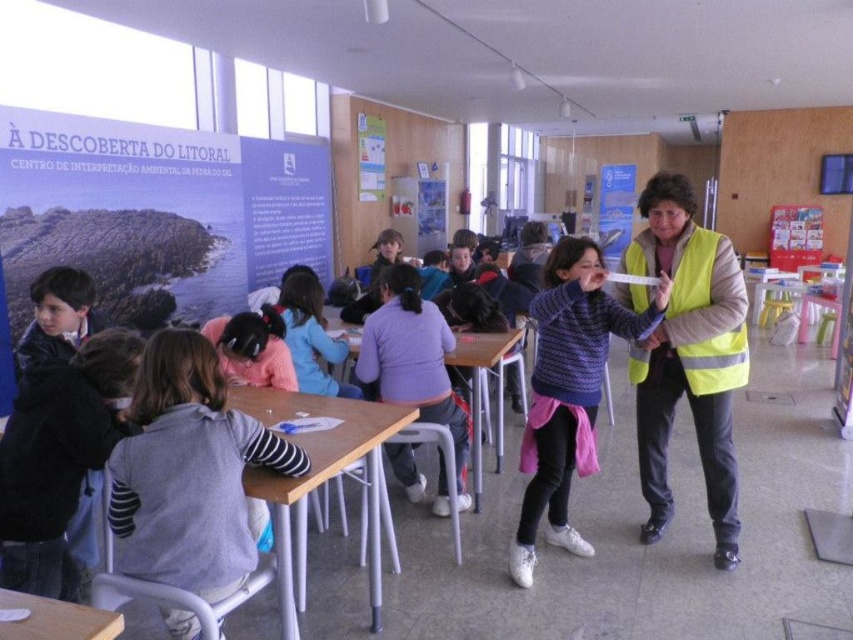
You are a teacher in the classroom and need to pass between the gray sweater at left and the knitted sweater at center to reach the whiteboard. Can you walk through the space between them without bending?

The distance between the gray sweater at left and the knitted sweater at center is 1.34 meters. Since an average person requires about 0.7 meters to walk comfortably, there is sufficient space for the teacher to pass through without bending.

You are a teacher observing the students in the classroom. You notice two sweaters on the chairs at the tables. The gray sweater at left and the knitted sweater at center. Which sweater is taller?

The knitted sweater at center is taller than the gray sweater at left.